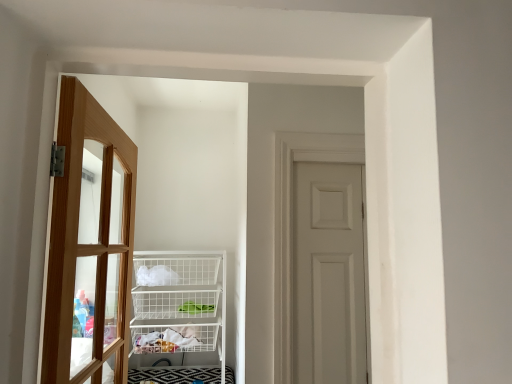
Question: In terms of size, does white matte door at center, the 1th door when ordered from back to front, appear bigger or smaller than light brown wooden door at left, the 1th door from the front?

Choices:
 (A) small
 (B) big

Answer: (A)

Question: Is white matte door at center, the second door positioned from the left, to the left or to the right of light brown wooden door at left, the 1th door from the front, in the image?

Choices:
 (A) right
 (B) left

Answer: (A)

Question: Which is farther from the light brown wooden door at left, which is the 2th door from right to left?

Choices:
 (A) white matte door at center, the 1th door when ordered from back to front
 (B) white wire basket at center

Answer: (A)

Question: Estimate the real-world distances between objects in this image. Which object is closer to the white wire basket at center?

Choices:
 (A) white matte door at center, the second door positioned from the left
 (B) light brown wooden door at left, which is the 2th door from right to left

Answer: (B)